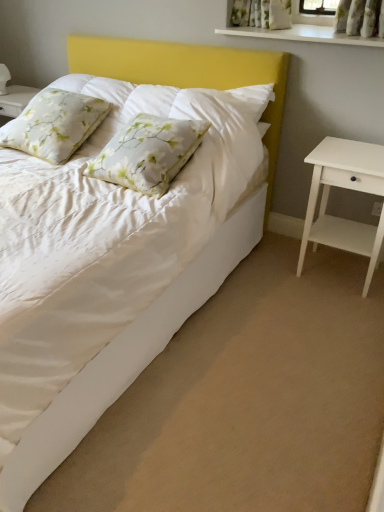
Question: Does white satin bed at lower left have a greater width compared to white glossy shelf at upper center?

Choices:
 (A) no
 (B) yes

Answer: (B)

Question: Can you confirm if white satin bed at lower left is taller than white glossy shelf at upper center?

Choices:
 (A) yes
 (B) no

Answer: (A)

Question: From the image's perspective, is white satin bed at lower left above white glossy shelf at upper center?

Choices:
 (A) no
 (B) yes

Answer: (A)

Question: Is white satin bed at lower left not close to white glossy shelf at upper center?

Choices:
 (A) yes
 (B) no

Answer: (A)

Question: Does white satin bed at lower left lie in front of white glossy shelf at upper center?

Choices:
 (A) no
 (B) yes

Answer: (B)

Question: Considering the positions of white matte nightstand at right and white floral pillow at center, positioned as the second pillow in left-to-right order, in the image, is white matte nightstand at right taller or shorter than white floral pillow at center, positioned as the second pillow in left-to-right order,?

Choices:
 (A) short
 (B) tall

Answer: (B)

Question: In the image, is white matte nightstand at right positioned in front of or behind white floral pillow at center, positioned as the second pillow in left-to-right order?

Choices:
 (A) front
 (B) behind

Answer: (B)

Question: From a real-world perspective, relative to white floral pillow at center, positioned as the second pillow in left-to-right order, is white matte nightstand at right vertically above or below?

Choices:
 (A) above
 (B) below

Answer: (B)

Question: Is white matte nightstand at right wider or thinner than white floral pillow at center, positioned as the second pillow in left-to-right order?

Choices:
 (A) wide
 (B) thin

Answer: (B)

Question: Would you say white satin bed at lower left is to the left or to the right of white floral pillow at center, placed as the 1th pillow when sorted from right to left, in the picture?

Choices:
 (A) left
 (B) right

Answer: (B)

Question: In terms of width, does white satin bed at lower left look wider or thinner when compared to white floral pillow at center, positioned as the second pillow in left-to-right order?

Choices:
 (A) wide
 (B) thin

Answer: (A)

Question: Considering the positions of point (241, 206) and point (140, 169), is point (241, 206) closer or farther from the camera than point (140, 169)?

Choices:
 (A) closer
 (B) farther

Answer: (B)

Question: From their relative heights in the image, would you say white satin bed at lower left is taller or shorter than white floral pillow at center, placed as the 1th pillow when sorted from right to left?

Choices:
 (A) short
 (B) tall

Answer: (A)

Question: Considering the positions of floral fabric pillow at upper left, placed as the 2th pillow when sorted from right to left, and white matte nightstand at right in the image, is floral fabric pillow at upper left, placed as the 2th pillow when sorted from right to left, bigger or smaller than white matte nightstand at right?

Choices:
 (A) big
 (B) small

Answer: (B)

Question: Is floral fabric pillow at upper left, the 1th pillow in the left-to-right sequence, taller or shorter than white matte nightstand at right?

Choices:
 (A) tall
 (B) short

Answer: (B)